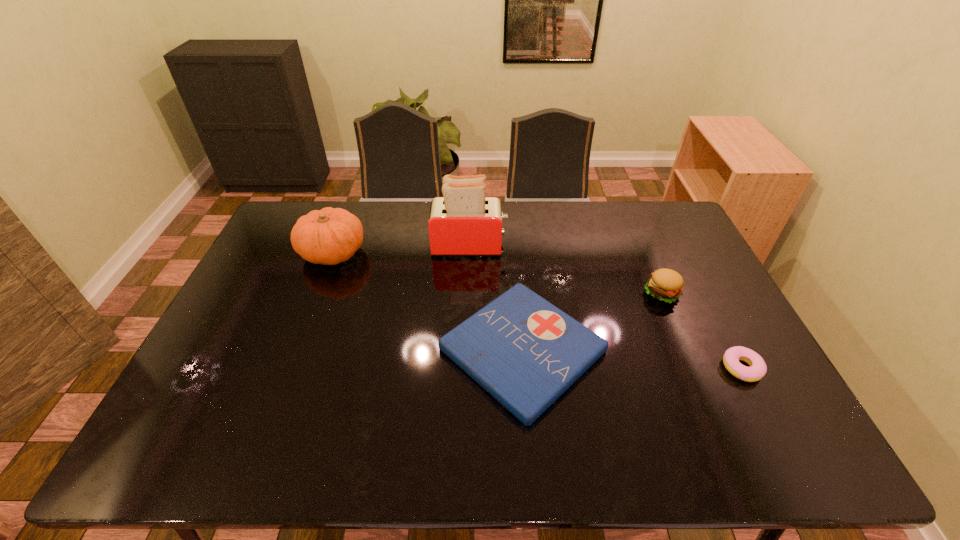
At what (x,y) coordinates should I click in order to perform the action: click on the tallest object. Please return your answer as a coordinate pair (x, y). This screenshot has height=540, width=960. Looking at the image, I should click on (463, 222).

Identify the location of pumpkin. (329, 236).

The height and width of the screenshot is (540, 960). Identify the location of the fourth shortest object. (329, 236).

Identify the location of hamburger. The height and width of the screenshot is (540, 960). coord(666,285).

Identify the location of the third shortest object. (666, 285).

Where is `the first-aid kit`? the first-aid kit is located at coordinates (x=524, y=351).

This screenshot has width=960, height=540. What are the coordinates of `the rightmost object` in the screenshot? It's located at (757, 370).

At what (x,y) coordinates should I click in order to perform the action: click on blank space located on the front-facing side of the toaster. Please return your answer as a coordinate pair (x, y). Image resolution: width=960 pixels, height=540 pixels. Looking at the image, I should click on (550, 246).

At what (x,y) coordinates should I click in order to perform the action: click on vacant space located on the back of the pumpkin. Please return your answer as a coordinate pair (x, y). Looking at the image, I should click on (351, 204).

Where is `vacant space located on the left of the second object from right to left`? Image resolution: width=960 pixels, height=540 pixels. vacant space located on the left of the second object from right to left is located at coordinates (545, 293).